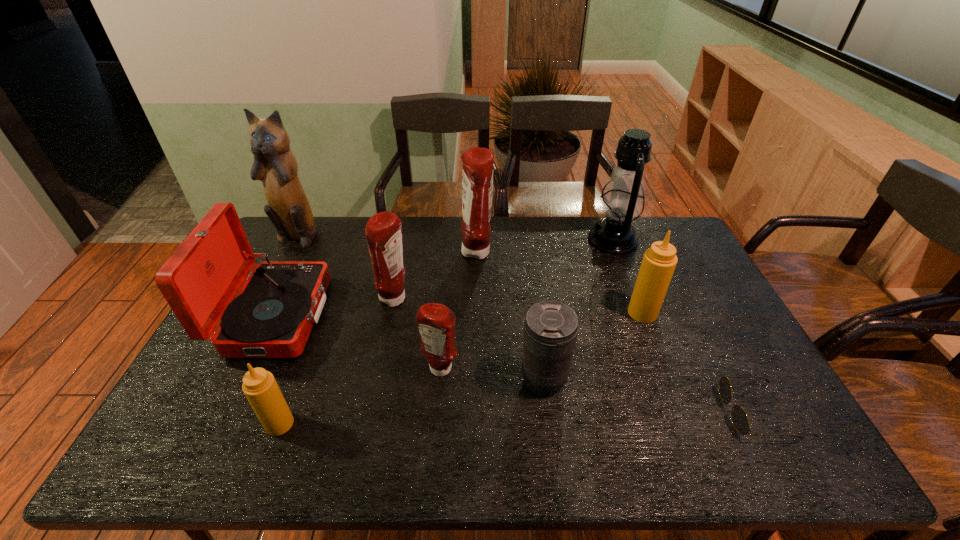
This screenshot has width=960, height=540. What are the coordinates of `cat` in the screenshot? It's located at (275, 165).

You are a GUI agent. You are given a task and a screenshot of the screen. Output one action in this format:
    pyautogui.click(x=<x>, y=<y>)
    Task: Click on the black oil lamp
    Image resolution: width=960 pixels, height=540 pixels.
    Given the screenshot: What is the action you would take?
    pyautogui.click(x=622, y=201)

Locate an element on the screen. The height and width of the screenshot is (540, 960). the biggest red condiment is located at coordinates (477, 175).

Find the location of a particular element. The image size is (960, 540). the farthest red condiment is located at coordinates (477, 175).

This screenshot has width=960, height=540. I want to click on phonograph_record, so coord(272,316).

Find the location of a particular element. The image size is (960, 540). the leftmost red condiment is located at coordinates (383, 234).

Identify the location of the fourth object from left to right. This screenshot has height=540, width=960. (383, 234).

Where is `the rightmost condiment`? the rightmost condiment is located at coordinates (659, 261).

Locate an element on the screen. This screenshot has height=540, width=960. the bigger tan condiment is located at coordinates (659, 261).

At what (x,y) coordinates should I click in order to perform the action: click on telephoto lens. Please return your answer as a coordinate pair (x, y). The height and width of the screenshot is (540, 960). Looking at the image, I should click on (550, 332).